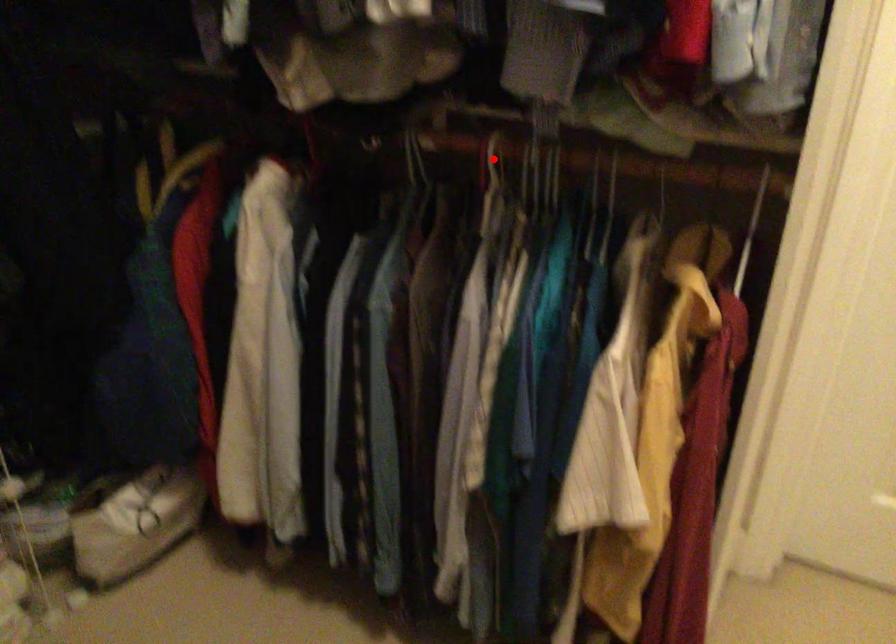
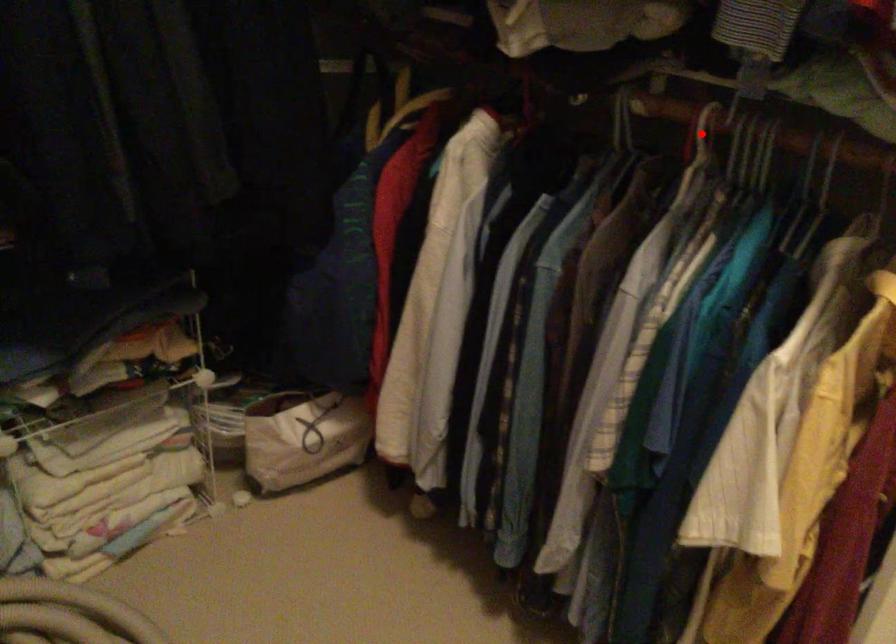
I am providing you with two images of the same scene from different viewpoints. A red point is marked on the first image and another point is marked on the second image. Does the point marked in image1 correspond to the same location as the one in image2?

Yes